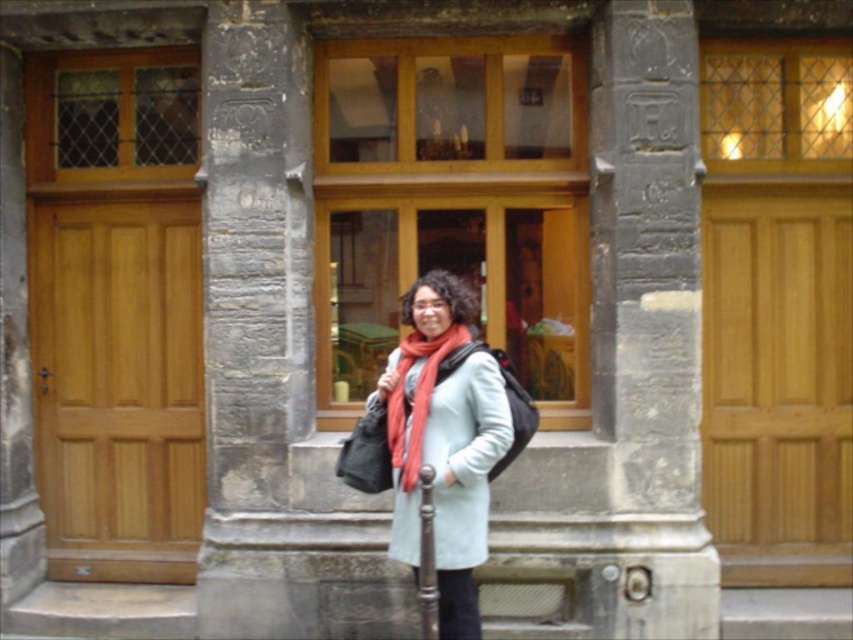
Question: Can you confirm if gray stone pillar at center is wider than light brown wood door at left?

Choices:
 (A) yes
 (B) no

Answer: (B)

Question: Among these objects, which one is farthest from the camera?

Choices:
 (A) matte blue coat at center
 (B) light brown wood door at right
 (C) gray stone pillar at center
 (D) light brown wood door at left

Answer: (D)

Question: Estimate the real-world distances between objects in this image. Which object is closer to the light brown wood door at left?

Choices:
 (A) matte red scarf at center
 (B) light brown wood door at right
 (C) matte blue coat at center
 (D) gray stone pillar at center

Answer: (D)

Question: Does light brown wood door at right appear on the left side of matte blue coat at center?

Choices:
 (A) no
 (B) yes

Answer: (A)

Question: Is gray stone pillar at center in front of light brown wood door at right?

Choices:
 (A) no
 (B) yes

Answer: (B)

Question: Which of the following is the closest to the observer?

Choices:
 (A) light brown wood door at left
 (B) light brown wood door at right
 (C) matte blue coat at center
 (D) matte red scarf at center

Answer: (C)